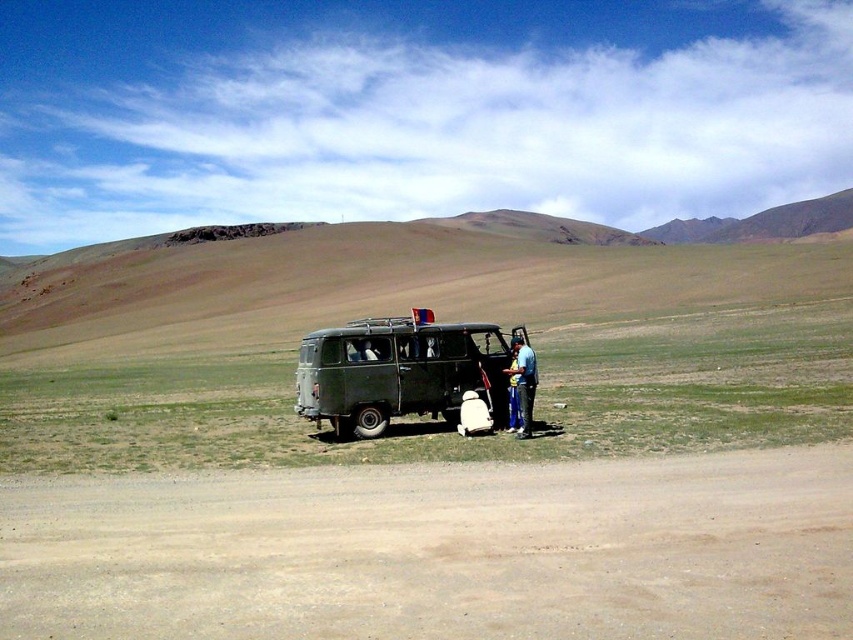
Question: Does brown sandy dirt at lower center appear under matte green van at center?

Choices:
 (A) yes
 (B) no

Answer: (A)

Question: Among these objects, which one is nearest to the camera?

Choices:
 (A) brown sandy dirt at lower center
 (B) matte green van at center

Answer: (A)

Question: Which point is farther from the camera taking this photo?

Choices:
 (A) (505, 371)
 (B) (485, 472)

Answer: (A)

Question: Is brown sandy dirt at lower center to the right of blue fabric bag at center from the viewer's perspective?

Choices:
 (A) yes
 (B) no

Answer: (B)

Question: Can you confirm if brown sandy dirt at lower center is smaller than blue fabric bag at center?

Choices:
 (A) no
 (B) yes

Answer: (A)

Question: Among these points, which one is nearest to the camera?

Choices:
 (A) (418, 324)
 (B) (526, 346)
 (C) (521, 561)

Answer: (C)